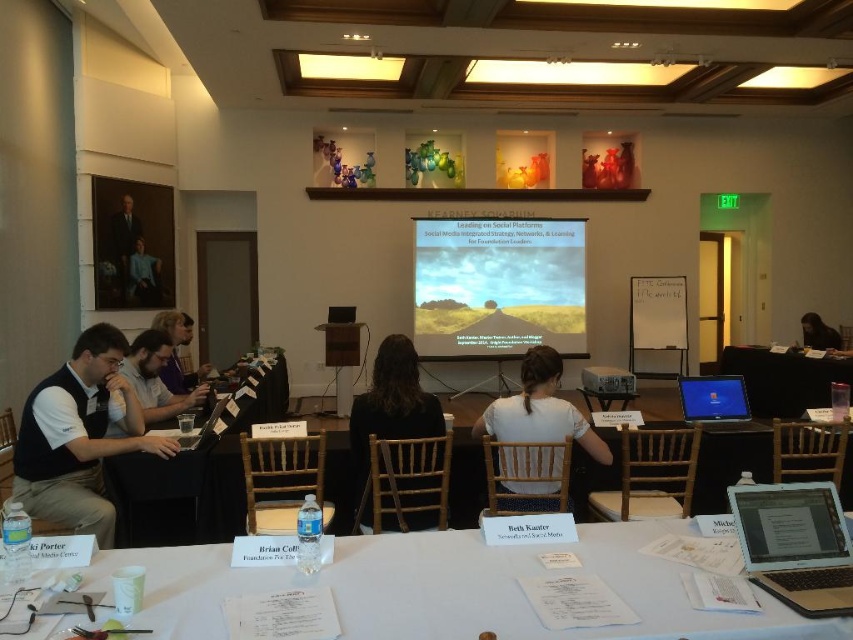
You are standing in the conference room and want to locate the person wearing the matte black shirt at upper left. According to the coordinates provided, where would you look to find this person?

The person wearing the matte black shirt at upper left is located at coordinates point 0.431 on the x axis and 0.169 on the y axis.

You are a participant in the conference room and need to place your silver metallic laptop at lower right on the white plastic table at center. Can you move it directly to the right side of the table?

The white plastic table at center is already to the right of the silver metallic laptop at lower right, so moving the laptop to the right side of the table would place it further away from its current position. The laptop cannot be placed directly to the right of the table as it is already positioned to the left of the table.